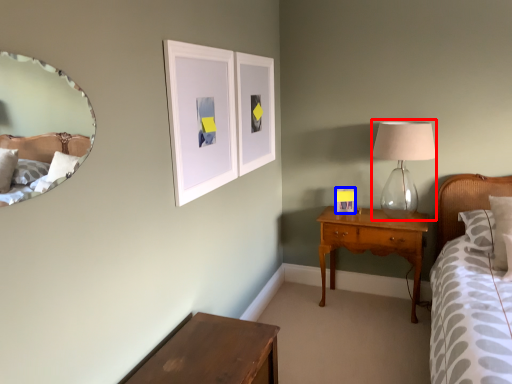
Question: Which of the following is the closest to the observer, table lamp (highlighted by a red box) or picture frame (highlighted by a blue box)?

Choices:
 (A) table lamp
 (B) picture frame

Answer: (A)